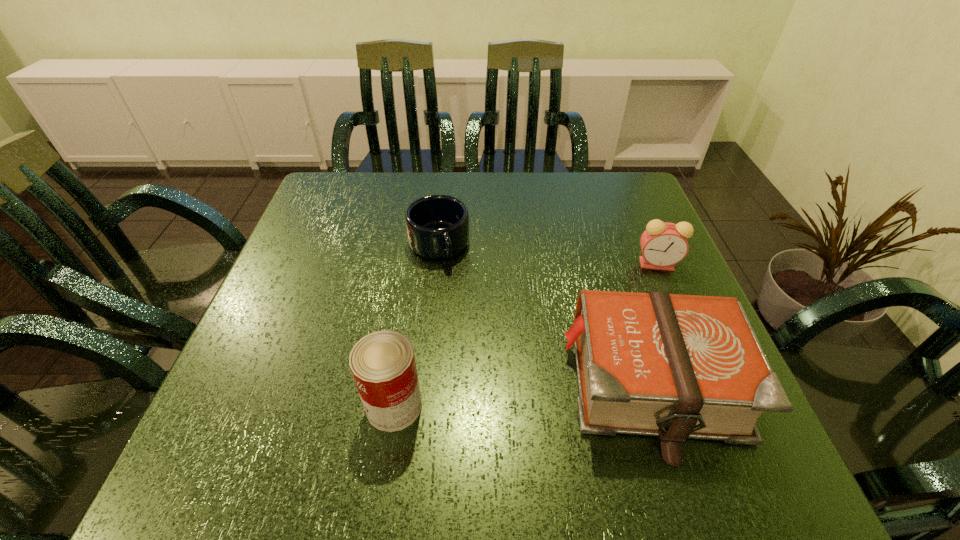
The width and height of the screenshot is (960, 540). What are the coordinates of `vacant space on the desktop that is between the can and the Bible and is positioned on the face of the alarm clock` in the screenshot? It's located at (489, 399).

The image size is (960, 540). I want to click on vacant space on the desktop that is between the tallest object and the Bible and is positioned with the handle on the side of the shortest object, so click(x=504, y=397).